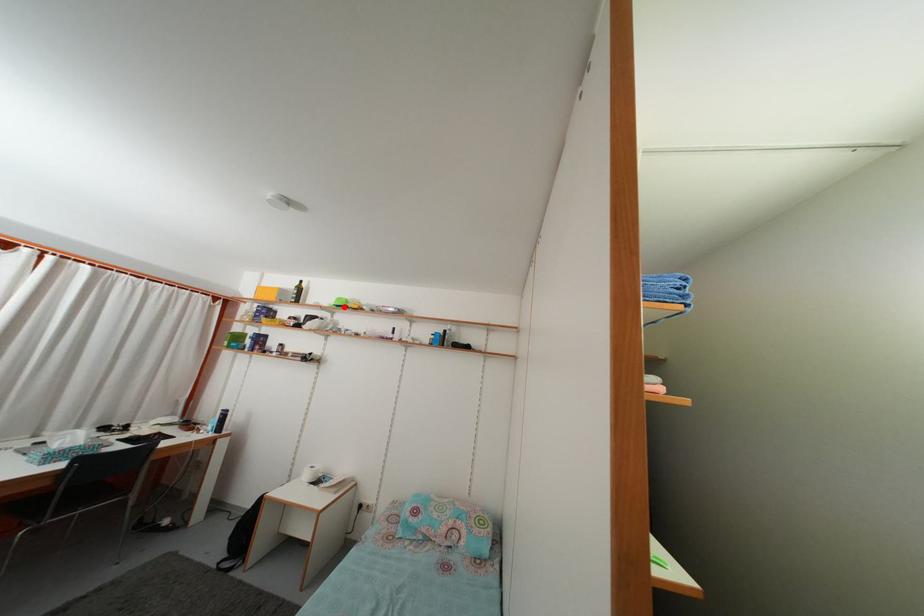
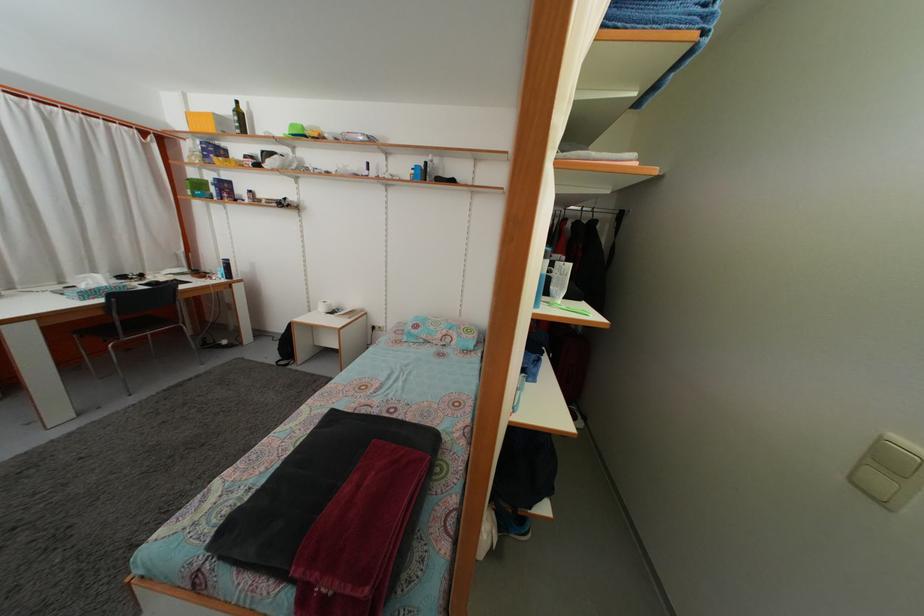
Question: I am providing you with two images of the same scene from different viewpoints. Given a red point in image1, look at the same physical point in image2. Is it:

Choices:
 (A) Closer to the viewpoint
 (B) Farther from the viewpoint

Answer: (A)